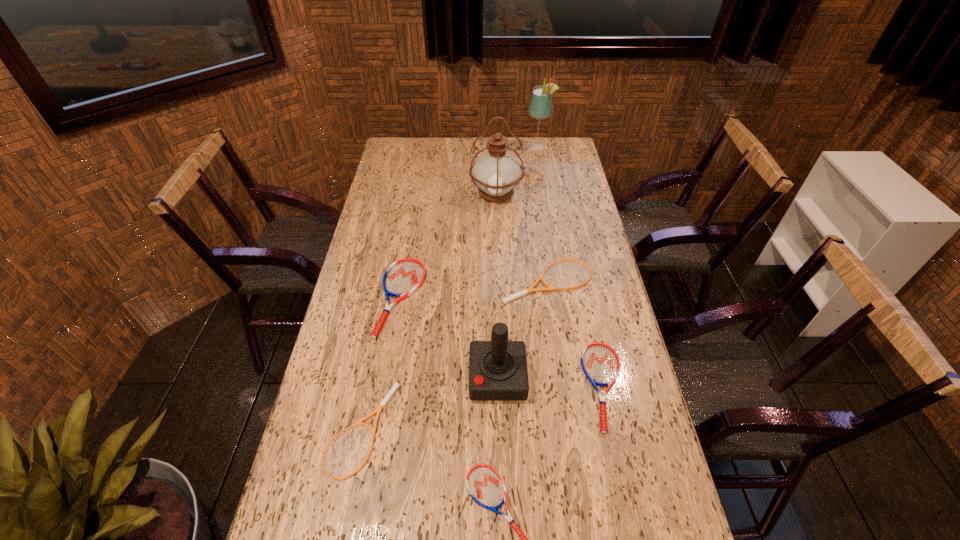
Identify the location of blank region between the leftmost blue tennis racket and the smaller beige tennis racket. (380, 364).

The width and height of the screenshot is (960, 540). Identify the location of free spot between the sixth shortest object and the biggest blue tennis racket. (449, 338).

At what (x,y) coordinates should I click in order to perform the action: click on blank region between the oil lamp and the farthest blue tennis racket. Please return your answer as a coordinate pair (x, y). This screenshot has width=960, height=540. Looking at the image, I should click on (448, 246).

At what (x,y) coordinates should I click in order to perform the action: click on object that can be found as the fifth closest to the shortest tennis racket. Please return your answer as a coordinate pair (x, y). This screenshot has width=960, height=540. Looking at the image, I should click on (550, 288).

Find the location of a particular element. Image resolution: width=960 pixels, height=540 pixels. object that is the third closest one to the nearer beige tennis racket is located at coordinates (498, 371).

Identify the location of tennis racket that is the closest to the alcohol. Image resolution: width=960 pixels, height=540 pixels. [550, 288].

Select which tennis racket is the fourth closest to the right beige tennis racket. Please provide its 2D coordinates. Your answer should be formatted as a tuple, i.e. [(x, y)], where the tuple contains the x and y coordinates of a point satisfying the conditions above.

[(485, 485)]

Identify the location of the closest blue tennis racket to the left beige tennis racket. (402, 278).

Identify the location of the closest blue tennis racket relative to the red joystick. Image resolution: width=960 pixels, height=540 pixels. (600, 363).

Where is `beige tennis racket that is the second closest to the smallest blue tennis racket`? beige tennis racket that is the second closest to the smallest blue tennis racket is located at coordinates (550, 288).